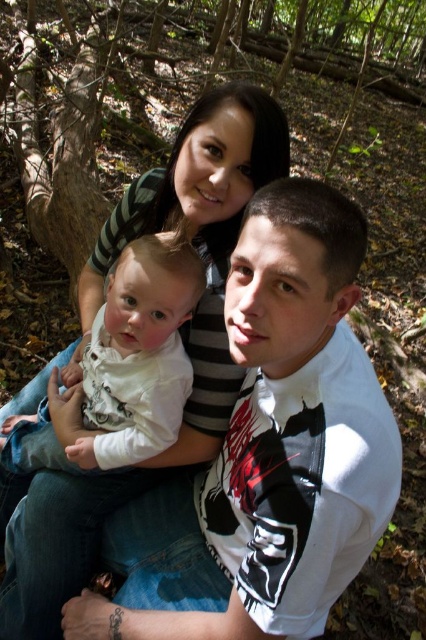
From the picture: Which is more to the left, white matte shirt at center or striped knit sweater at center?

striped knit sweater at center is more to the left.

Is white matte shirt at center positioned in front of striped knit sweater at center?

Yes.

What are the coordinates of `white matte shirt at center` in the screenshot? It's located at (268, 451).

This screenshot has height=640, width=426. I want to click on white matte shirt at center, so click(268, 451).

Between striped knit sweater at center and white soft fabric baby at center, which one has less height?

Standing shorter between the two is white soft fabric baby at center.

Which of these two, striped knit sweater at center or white soft fabric baby at center, stands taller?

striped knit sweater at center is taller.

Who is more distant from viewer, (x=206, y=225) or (x=112, y=307)?

Point (x=206, y=225)

At what (x,y) coordinates should I click in order to perform the action: click on striped knit sweater at center. Please return your answer as a coordinate pair (x, y). This screenshot has height=640, width=426. Looking at the image, I should click on (181, 337).

Can you confirm if white matte shirt at center is smaller than white soft fabric baby at center?

No, white matte shirt at center is not smaller than white soft fabric baby at center.

Between white matte shirt at center and white soft fabric baby at center, which one is positioned lower?

white matte shirt at center

Is point (282, 432) closer to viewer compared to point (71, 460)?

Yes, it is.

Where is `white matte shirt at center`? The height and width of the screenshot is (640, 426). white matte shirt at center is located at coordinates (268, 451).